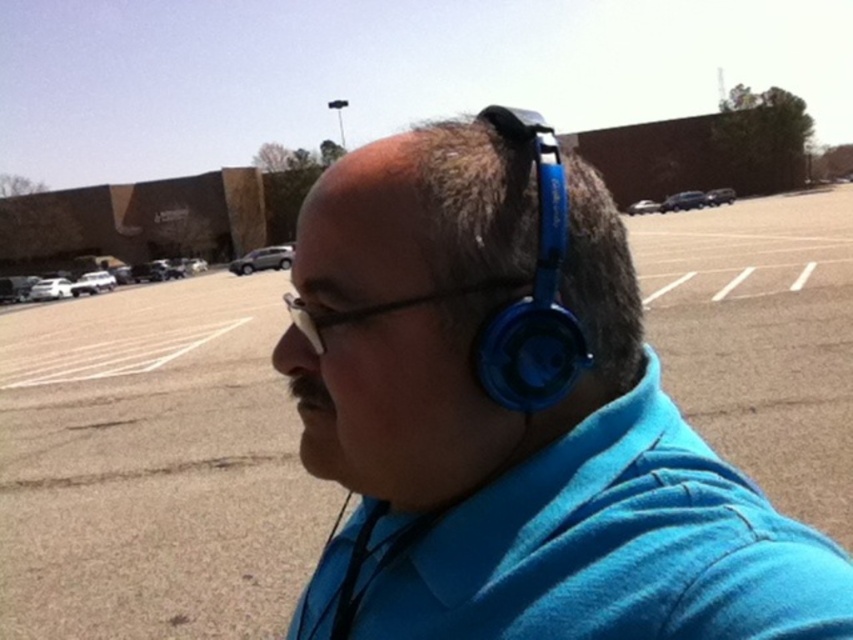
Can you confirm if blue matte headphones at center is positioned to the left of blue plastic headphones at upper right?

No, blue matte headphones at center is not to the left of blue plastic headphones at upper right.

Does blue matte headphones at center have a greater width compared to blue plastic headphones at upper right?

Yes, blue matte headphones at center is wider than blue plastic headphones at upper right.

The width and height of the screenshot is (853, 640). I want to click on blue matte headphones at center, so click(x=514, y=420).

You are a GUI agent. You are given a task and a screenshot of the screen. Output one action in this format:
    pyautogui.click(x=<x>, y=<y>)
    Task: Click on the blue matte headphones at center
    The width and height of the screenshot is (853, 640).
    Given the screenshot: What is the action you would take?
    pyautogui.click(x=514, y=420)